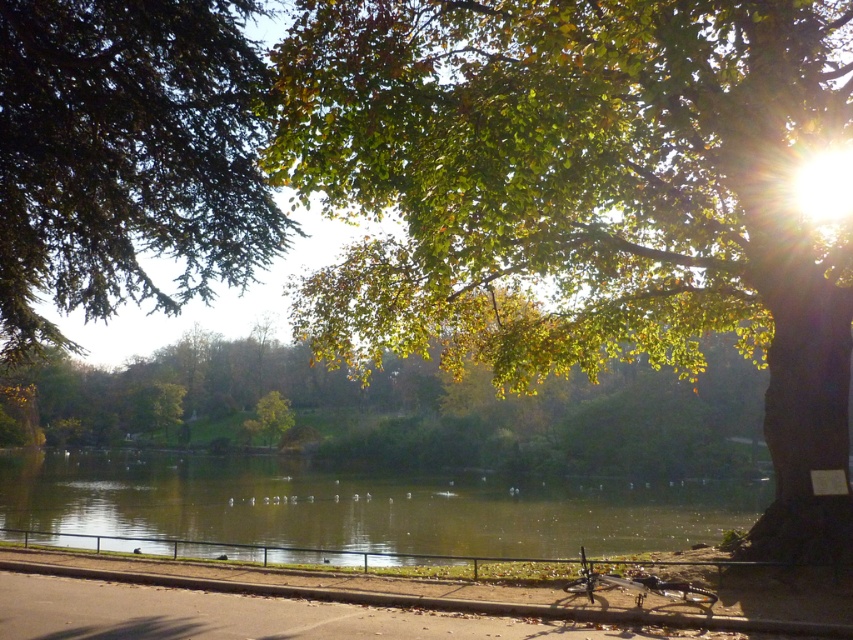
Question: Which point is closer to the camera?

Choices:
 (A) green leafy tree at upper right
 (B) shiny metallic bicycle at lower center

Answer: (A)

Question: Among these objects, which one is farthest from the camera?

Choices:
 (A) green textured leaves at upper left
 (B) green leafy tree at center

Answer: (B)

Question: Which point is closer to the camera?

Choices:
 (A) green textured leaves at upper left
 (B) shiny metallic bicycle at lower center

Answer: (B)

Question: Is shiny metallic bicycle at lower center above green leafy tree at center?

Choices:
 (A) yes
 (B) no

Answer: (B)

Question: Does green leafy tree at upper right have a smaller size compared to shiny metallic bicycle at lower center?

Choices:
 (A) no
 (B) yes

Answer: (A)

Question: Can you confirm if green reflective water at center is thinner than shiny metallic bicycle at lower center?

Choices:
 (A) yes
 (B) no

Answer: (B)